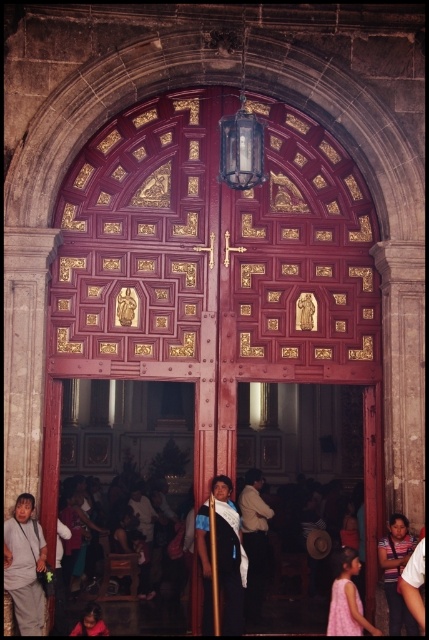
You are standing in front of the grand wooden door. A small insect lands on the point at coordinates (x=215, y=273). Where exactly on the door is the insect located?

The point at coordinates (x=215, y=273) corresponds to the polished wood door at center, so the insect is on the center of the door.